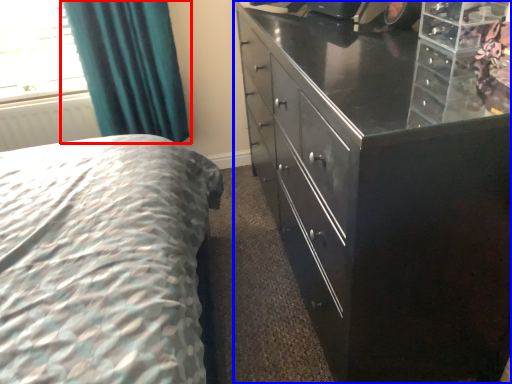
Question: Which object appears closest to the camera in this image, curtain (highlighted by a red box) or chest of drawers (highlighted by a blue box)?

Choices:
 (A) curtain
 (B) chest of drawers

Answer: (B)